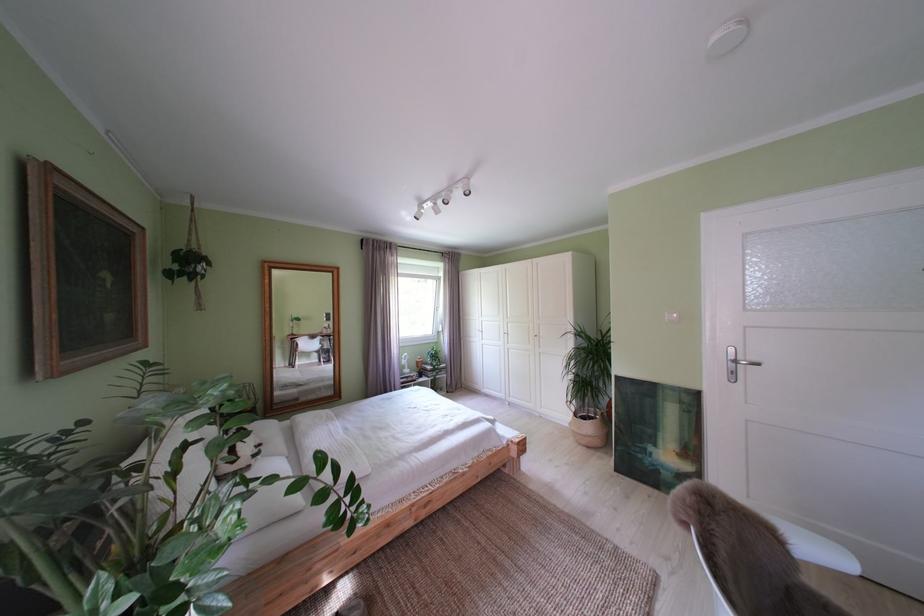
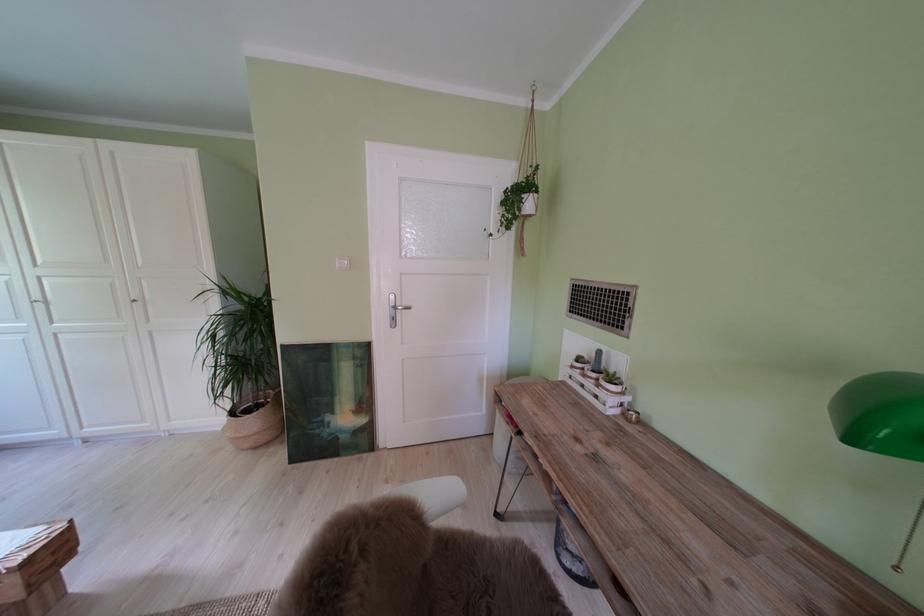
The point at (587, 419) is marked in the first image. Where is the corresponding point in the second image?

(242, 418)